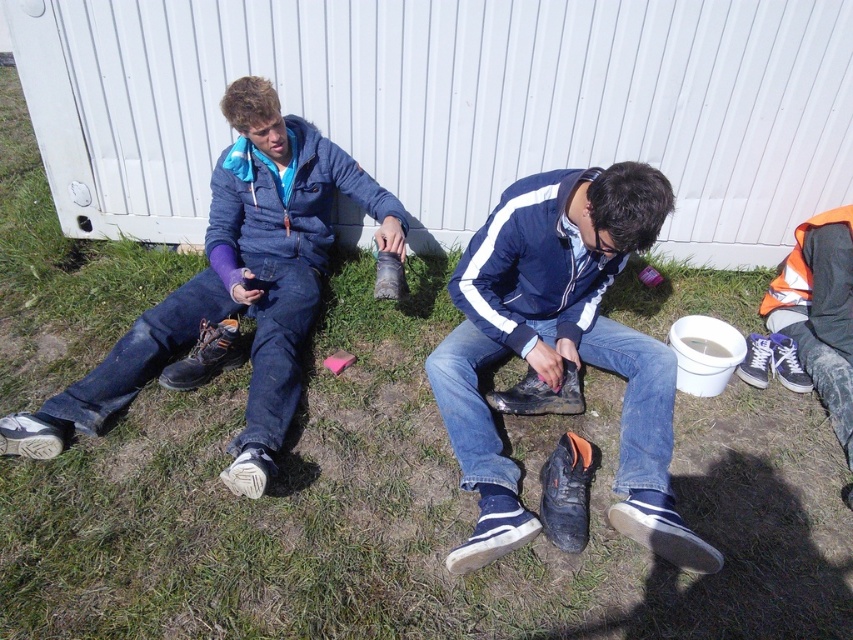
You are standing in the grassy area near the white corrugated metal wall. You see a brown leather shoe at lower left and a blue canvas shoe at lower right. Which shoe is positioned more to the left side?

The brown leather shoe at lower left is positioned more to the left side than the blue canvas shoe at lower right.

You are a delivery person who needs to deliver a package to the brown leather shoe at lower left and the blue canvas shoe at lower right. The delivery robot can only reach items that are taller than 10 centimeters. Can the robot deliver to both shoes?

The brown leather shoe at lower left is taller than the blue canvas shoe at lower right. Since the brown leather shoe at lower left is taller than 10 centimeters, the robot can deliver to it. However, the blue canvas shoe at lower right may be shorter than 10 centimeters, so the robot might not be able to deliver to it.